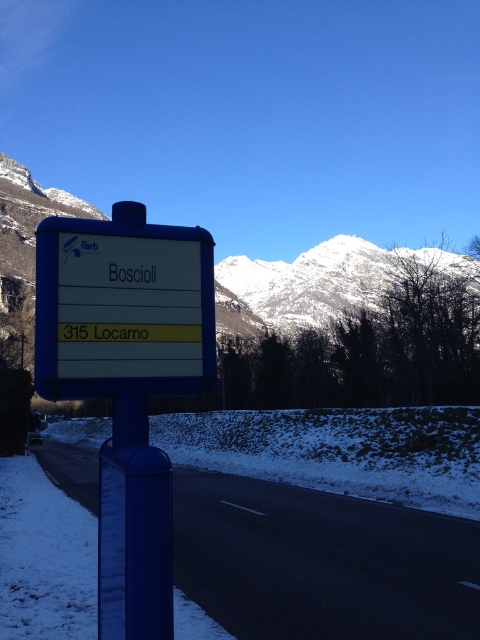
You are a driver approaching the road and see both the blue metallic sign at center and the blue plastic sign at center. Which one is bigger?

The blue metallic sign at center is larger in size than the blue plastic sign at center, so the blue metallic sign at center is bigger.